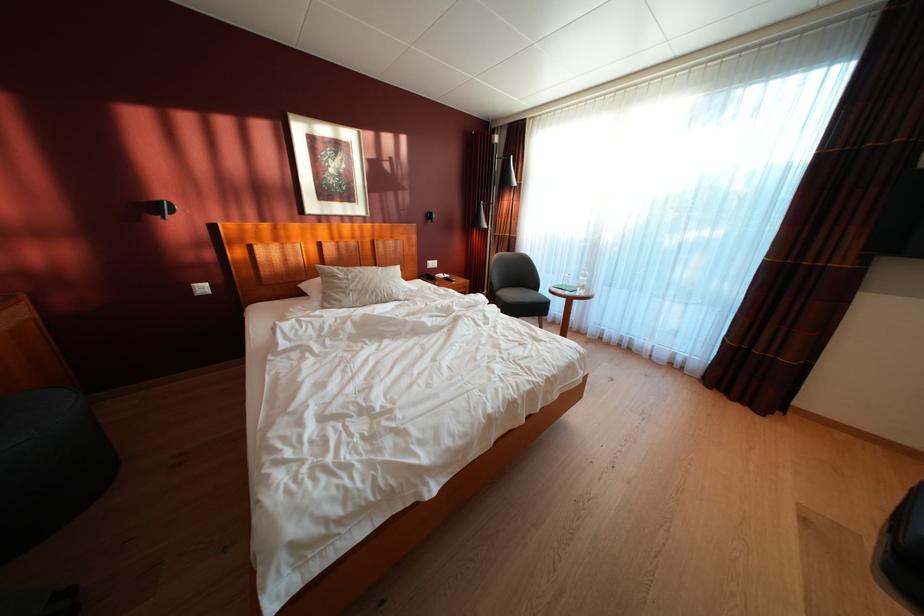
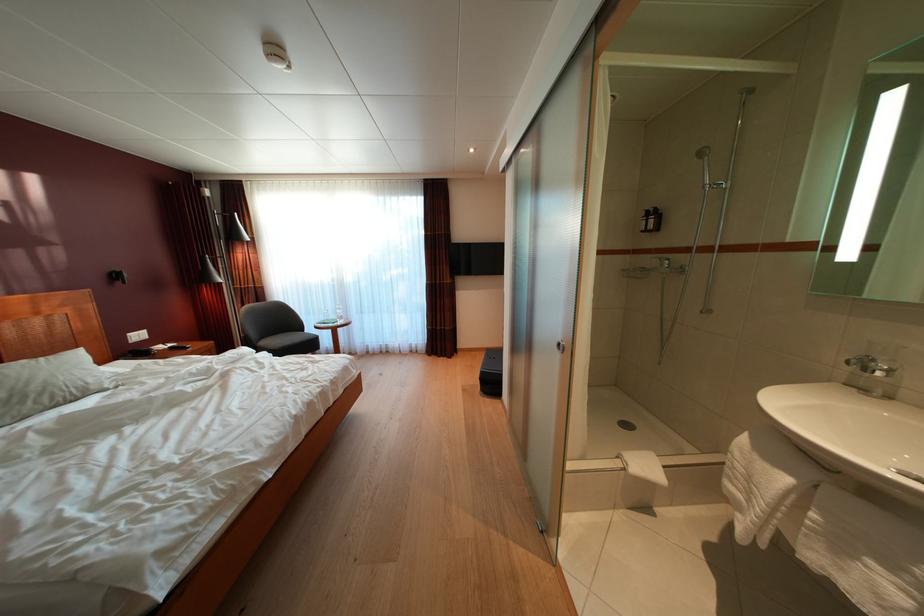
Question: The images are taken continuously from a first-person perspective. In which direction is your viewpoint rotating?

Choices:
 (A) Left
 (B) Right
 (C) Up
 (D) Down

Answer: (B)